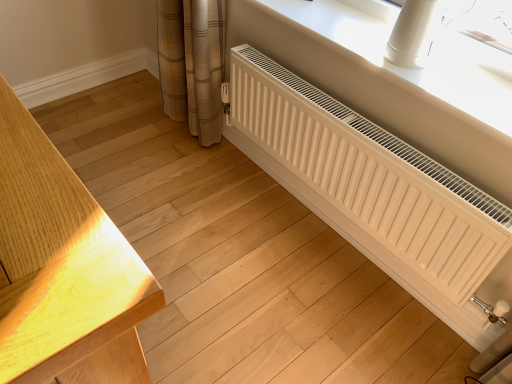
What do you see at coordinates (372, 189) in the screenshot? The image size is (512, 384). I see `white matte radiator at lower right` at bounding box center [372, 189].

The height and width of the screenshot is (384, 512). In order to click on white matte radiator at lower right in this screenshot , I will do `click(372, 189)`.

In order to face white plastic radiator at lower right, should I rotate leftwards or rightwards?

To align with it, rotate right about 14.901°.

Image resolution: width=512 pixels, height=384 pixels. What do you see at coordinates (428, 57) in the screenshot?
I see `white plastic radiator at lower right` at bounding box center [428, 57].

At what (x,y) coordinates should I click in order to perform the action: click on white plastic radiator at lower right. Please return your answer as a coordinate pair (x, y). This screenshot has width=512, height=384. Looking at the image, I should click on (428, 57).

Where is `white matte radiator at lower right`? The image size is (512, 384). white matte radiator at lower right is located at coordinates (372, 189).

Based on their positions, is white matte radiator at lower right located to the left or right of white plastic radiator at lower right?

white matte radiator at lower right is positioned on white plastic radiator at lower right's left side.

Which object is closer to the camera, white matte radiator at lower right or white plastic radiator at lower right?

white matte radiator at lower right.

Does point (280, 173) appear closer or farther from the camera than point (323, 5)?

Point (280, 173) appears to be farther away from the viewer than point (323, 5).

From the image's perspective, between white matte radiator at lower right and white plastic radiator at lower right, which one is located above?

white plastic radiator at lower right is shown above in the image.

From a real-world perspective, is white matte radiator at lower right located beneath white plastic radiator at lower right?

Indeed, from a real-world perspective, white matte radiator at lower right is positioned beneath white plastic radiator at lower right.

Can you confirm if white matte radiator at lower right is wider than white plastic radiator at lower right?

Incorrect, the width of white matte radiator at lower right does not surpass that of white plastic radiator at lower right.

Does white matte radiator at lower right have a greater height compared to white plastic radiator at lower right?

Correct, white matte radiator at lower right is much taller as white plastic radiator at lower right.

Looking at this image, does white matte radiator at lower right have a smaller size compared to white plastic radiator at lower right?

No, white matte radiator at lower right is not smaller than white plastic radiator at lower right.

Is white matte radiator at lower right inside the boundaries of white plastic radiator at lower right, or outside?

white matte radiator at lower right lies outside white plastic radiator at lower right.

Are white matte radiator at lower right and white plastic radiator at lower right beside each other?

There is a gap between white matte radiator at lower right and white plastic radiator at lower right.

In the scene shown: Is white plastic radiator at lower right at the back of white matte radiator at lower right?

white matte radiator at lower right does not have its back to white plastic radiator at lower right.

How different are the orientations of white matte radiator at lower right and white plastic radiator at lower right in degrees?

0.000298 degrees separate the facing orientations of white matte radiator at lower right and white plastic radiator at lower right.

In order to click on window sill behind the white matte radiator at lower right in this screenshot , I will do `click(428, 57)`.

Considering the relative positions of white plastic radiator at lower right and white matte radiator at lower right in the image provided, is white plastic radiator at lower right to the left or to the right of white matte radiator at lower right?

In the image, white plastic radiator at lower right appears on the right side of white matte radiator at lower right.

In the image, is white plastic radiator at lower right positioned in front of or behind white matte radiator at lower right?

Answer: Clearly, white plastic radiator at lower right is behind white matte radiator at lower right.

Which is more distant, (289,6) or (399,278)?

The point (399,278) is farther from the camera.

Consider the image. From the image's perspective, is white plastic radiator at lower right below white matte radiator at lower right?

No, from the image's perspective, white plastic radiator at lower right is not below white matte radiator at lower right.

From a real-world perspective, is white plastic radiator at lower right positioned under white matte radiator at lower right based on gravity?

No, from a real-world perspective, white plastic radiator at lower right is not beneath white matte radiator at lower right.

Considering the relative sizes of white plastic radiator at lower right and white matte radiator at lower right in the image provided, is white plastic radiator at lower right wider than white matte radiator at lower right?

Indeed, white plastic radiator at lower right has a greater width compared to white matte radiator at lower right.

Can you confirm if white plastic radiator at lower right is shorter than white matte radiator at lower right?

Yes.

Considering the sizes of objects white plastic radiator at lower right and white matte radiator at lower right in the image provided, who is smaller, white plastic radiator at lower right or white matte radiator at lower right?

Smaller between the two is white plastic radiator at lower right.

Would you say white plastic radiator at lower right contains white matte radiator at lower right?

No.

Is white plastic radiator at lower right far away from white matte radiator at lower right?

white plastic radiator at lower right is actually quite close to white matte radiator at lower right.

Is white plastic radiator at lower right aimed at white matte radiator at lower right?

No.

How different are the orientations of white plastic radiator at lower right and white matte radiator at lower right in degrees?

The facing directions of white plastic radiator at lower right and white matte radiator at lower right are 0.000298 degrees apart.

The height and width of the screenshot is (384, 512). What are the coordinates of `radiator below the white plastic radiator at lower right (from a real-world perspective)` in the screenshot? It's located at (372, 189).

You are a GUI agent. You are given a task and a screenshot of the screen. Output one action in this format:
    pyautogui.click(x=<x>, y=<y>)
    Task: Click on the radiator that appears on the left of white plastic radiator at lower right
    
    Given the screenshot: What is the action you would take?
    pyautogui.click(x=372, y=189)

This screenshot has height=384, width=512. Identify the location of window sill located above the white matte radiator at lower right (from the image's perspective). (428, 57).